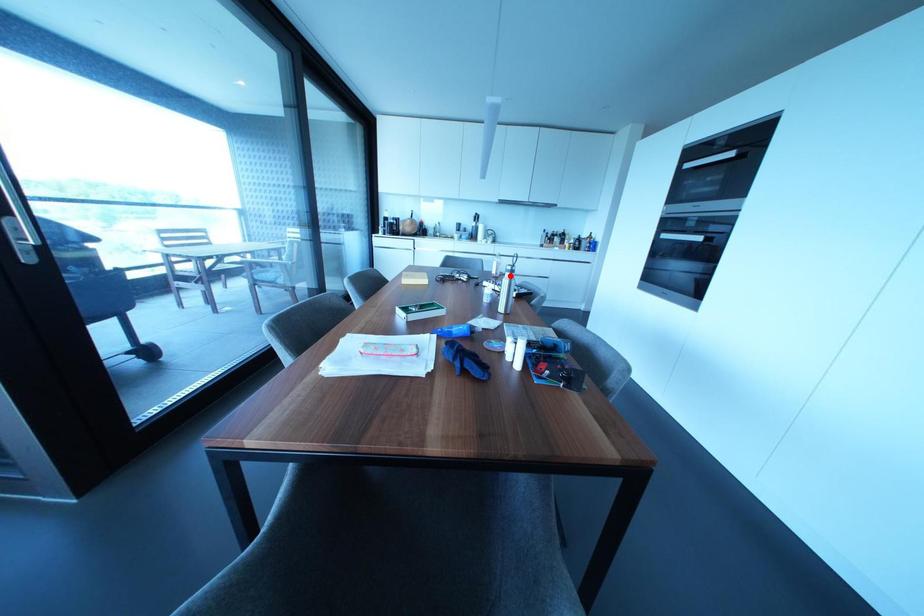
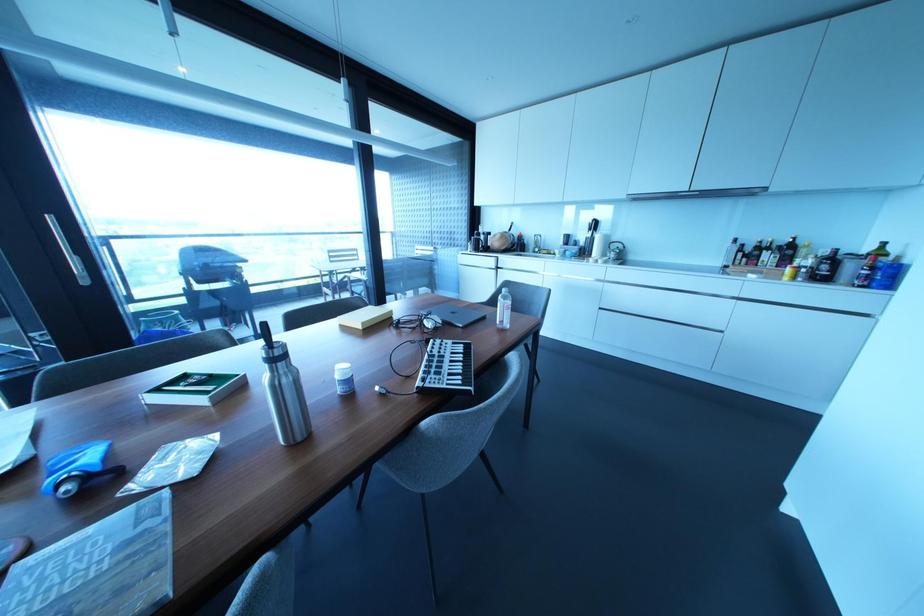
The point at the highlighted location is marked in the first image. Where is the corresponding point in the second image?

(273, 369)